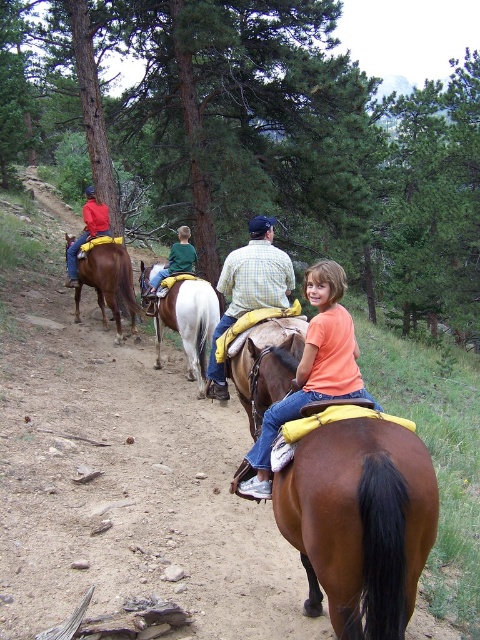
Question: Considering the real-world distances, which object is closest to the matte orange shirt at center?

Choices:
 (A) brown leather saddle at left
 (B) checkered fabric shirt at center
 (C) matte brown jacket at left
 (D) white glossy saddle at center

Answer: (B)

Question: From the image, what is the correct spatial relationship of matte orange shirt at center in relation to white glossy saddle at center?

Choices:
 (A) left
 (B) right

Answer: (B)

Question: In this image, where is matte orange shirt at center located relative to matte brown jacket at left?

Choices:
 (A) right
 (B) left

Answer: (A)

Question: Which of these objects is positioned farthest from the matte orange shirt at center?

Choices:
 (A) brown leather saddle at center
 (B) brown leather saddle at left
 (C) matte brown jacket at left
 (D) checkered fabric shirt at center

Answer: (C)

Question: Does brown leather saddle at center appear on the right side of white glossy saddle at center?

Choices:
 (A) no
 (B) yes

Answer: (B)

Question: Among these points, which one is nearest to the camera?

Choices:
 (A) (86, 216)
 (B) (370, 480)
 (C) (229, 317)
 (D) (309, 282)

Answer: (B)